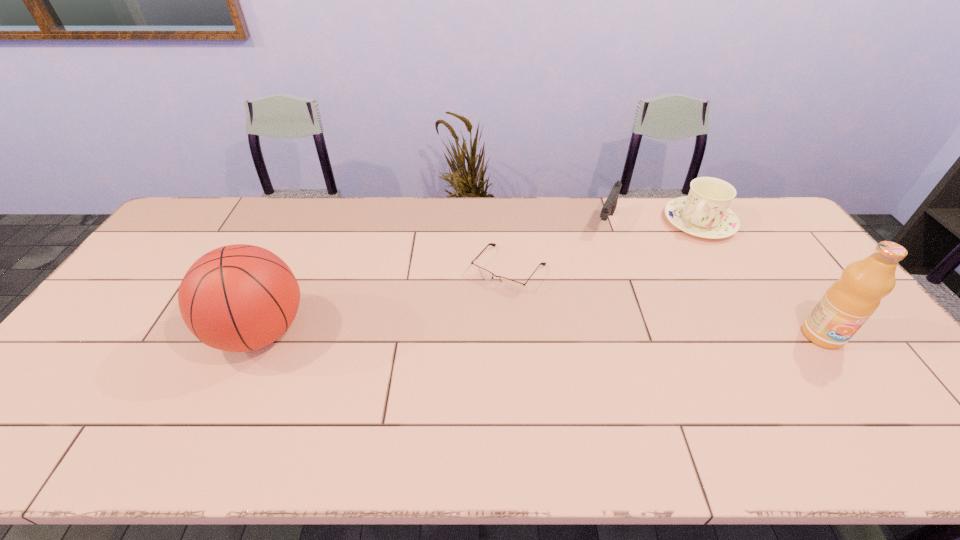
You are a GUI agent. You are given a task and a screenshot of the screen. Output one action in this format:
    pyautogui.click(x=<x>, y=<y>)
    Task: Click on the vacant point located between the basketball and the third object from left to right
    
    Given the screenshot: What is the action you would take?
    pyautogui.click(x=433, y=278)

Locate an element on the screen. The height and width of the screenshot is (540, 960). unoccupied area between the leftmost object and the second object from left to right is located at coordinates (385, 301).

The height and width of the screenshot is (540, 960). Find the location of `free space between the fruit juice and the chinaware`. free space between the fruit juice and the chinaware is located at coordinates (760, 279).

Locate an element on the screen. This screenshot has height=540, width=960. free point between the shortest object and the fruit juice is located at coordinates (665, 302).

This screenshot has width=960, height=540. Identify the location of free point between the fruit juice and the chinaware. (760, 279).

Locate an element on the screen. This screenshot has height=540, width=960. vacant space in between the fruit juice and the chinaware is located at coordinates (760, 279).

Where is `vacant point located between the chinaware and the pistol`? The image size is (960, 540). vacant point located between the chinaware and the pistol is located at coordinates (653, 222).

Locate an element on the screen. The width and height of the screenshot is (960, 540). object that is the closest to the chinaware is located at coordinates (610, 204).

Choose which object is the third nearest neighbor to the chinaware. Please provide its 2D coordinates. Your answer should be formatted as a tuple, i.e. [(x, y)], where the tuple contains the x and y coordinates of a point satisfying the conditions above.

[(509, 284)]